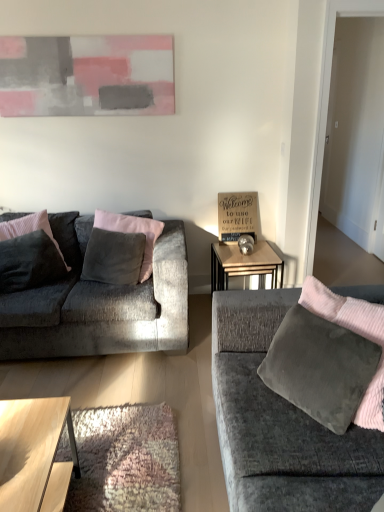
The image size is (384, 512). I want to click on free space below abstract painting at upper center (from a real-world perspective), so click(x=70, y=205).